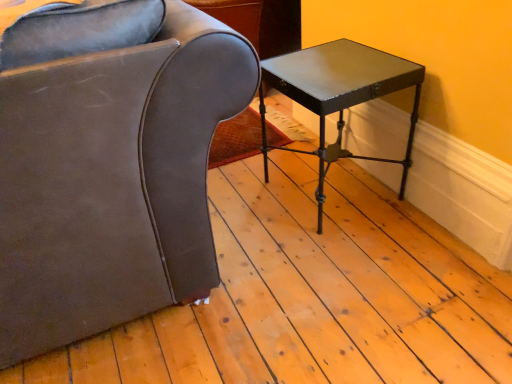
What do you see at coordinates (339, 95) in the screenshot? I see `glossy black table at right` at bounding box center [339, 95].

I want to click on glossy black table at right, so click(339, 95).

The image size is (512, 384). In order to click on brown leather chair at left in this screenshot , I will do `click(109, 163)`.

What do you see at coordinates (109, 163) in the screenshot? I see `brown leather chair at left` at bounding box center [109, 163].

Where is `glossy black table at right`? The image size is (512, 384). glossy black table at right is located at coordinates (339, 95).

Which object is positioned more to the left, brown leather chair at left or glossy black table at right?

From the viewer's perspective, brown leather chair at left appears more on the left side.

In the scene shown: Considering the positions of objects brown leather chair at left and glossy black table at right in the image provided, who is behind, brown leather chair at left or glossy black table at right?

glossy black table at right is further from the camera.

Which point is more distant from viewer, (6, 98) or (320, 50)?

The point (320, 50) is farther.

From the image's perspective, does brown leather chair at left appear lower than glossy black table at right?

Incorrect, from the image's perspective, brown leather chair at left is higher than glossy black table at right.

From a real-world perspective, which is physically above, brown leather chair at left or glossy black table at right?

brown leather chair at left.

Does brown leather chair at left have a lesser width compared to glossy black table at right?

No, brown leather chair at left is not thinner than glossy black table at right.

Considering the sizes of objects brown leather chair at left and glossy black table at right in the image provided, who is taller, brown leather chair at left or glossy black table at right?

Standing taller between the two is brown leather chair at left.

Considering the sizes of brown leather chair at left and glossy black table at right in the image, is brown leather chair at left bigger or smaller than glossy black table at right?

Considering their sizes, brown leather chair at left takes up more space than glossy black table at right.

Is glossy black table at right completely or partially inside brown leather chair at left?

No, glossy black table at right is not a part of brown leather chair at left.

Are brown leather chair at left and glossy black table at right located far from each other?

No, brown leather chair at left is not far from glossy black table at right.

Is brown leather chair at left oriented away from glossy black table at right?

No, brown leather chair at left is not facing away from glossy black table at right.

How different are the orientations of brown leather chair at left and glossy black table at right in degrees?

There is a 94.7-degree angle between the facing directions of brown leather chair at left and glossy black table at right.

How far apart are brown leather chair at left and glossy black table at right?

brown leather chair at left is 22.82 inches away from glossy black table at right.

Where is `chair that is on the left side of glossy black table at right`? The height and width of the screenshot is (384, 512). chair that is on the left side of glossy black table at right is located at coordinates (109, 163).

Is glossy black table at right to the left of brown leather chair at left from the viewer's perspective?

No.

Does glossy black table at right come in front of brown leather chair at left?

No.

Is point (260, 109) farther from viewer compared to point (14, 233)?

Yes, it is behind point (14, 233).

From the image's perspective, between glossy black table at right and brown leather chair at left, which one is located above?

brown leather chair at left is shown above in the image.

From a real-world perspective, between glossy black table at right and brown leather chair at left, who is vertically lower?

In real-world perspective, glossy black table at right is lower.

In terms of width, does glossy black table at right look wider or thinner when compared to brown leather chair at left?

Clearly, glossy black table at right has less width compared to brown leather chair at left.

Consider the image. Is glossy black table at right taller than brown leather chair at left?

No, glossy black table at right is not taller than brown leather chair at left.

In terms of size, does glossy black table at right appear bigger or smaller than brown leather chair at left?

In the image, glossy black table at right appears to be smaller than brown leather chair at left.

Is glossy black table at right located outside brown leather chair at left?

That's correct, glossy black table at right is outside of brown leather chair at left.

Is glossy black table at right positioned far away from brown leather chair at left?

No, glossy black table at right is in close proximity to brown leather chair at left.

Is glossy black table at right facing towards brown leather chair at left?

Yes, glossy black table at right faces towards brown leather chair at left.

How many degrees apart are the facing directions of glossy black table at right and brown leather chair at left?

The angular difference between glossy black table at right and brown leather chair at left is 94.7 degrees.

The width and height of the screenshot is (512, 384). Find the location of `chair above the glossy black table at right (from the image's perspective)`. chair above the glossy black table at right (from the image's perspective) is located at coordinates (109, 163).

Image resolution: width=512 pixels, height=384 pixels. I want to click on table that appears below the brown leather chair at left (from the image's perspective), so click(x=339, y=95).

Where is `table beneath the brown leather chair at left (from a real-world perspective)`? table beneath the brown leather chair at left (from a real-world perspective) is located at coordinates (339, 95).